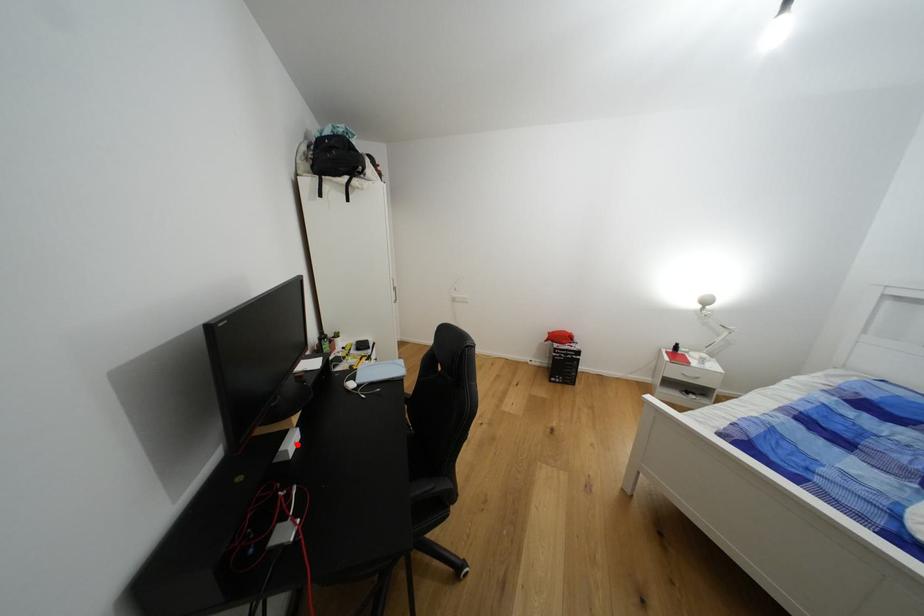
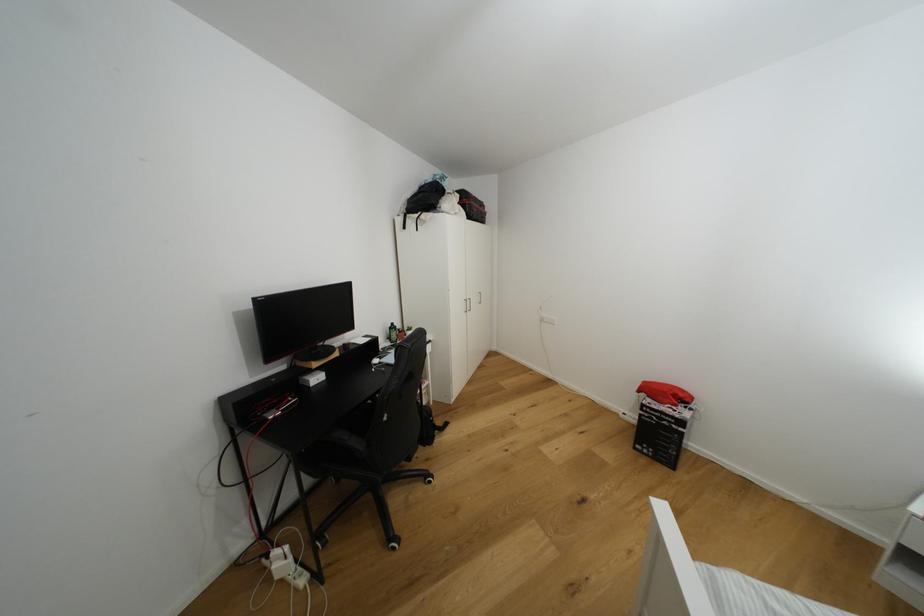
The point at the highlighted location is marked in the first image. Where is the corresponding point in the second image?

(322, 379)